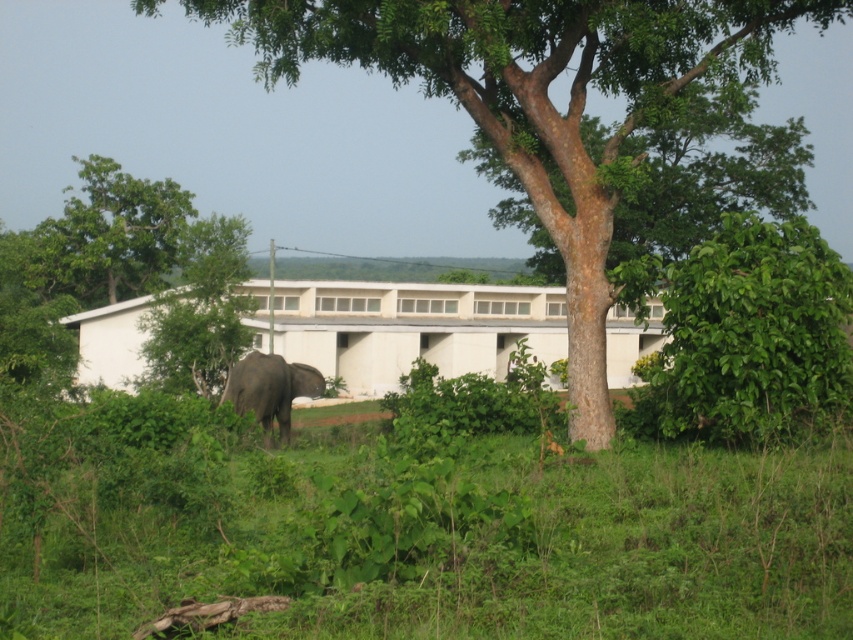
Question: Which point is farther from the camera taking this photo?

Choices:
 (A) 99,189
 (B) 264,413
 (C) 556,572

Answer: (A)

Question: Which of these objects is positioned farthest from the brown rough tree at center?

Choices:
 (A) green leafy tree at upper left
 (B) green leafy grass at lower center
 (C) gray matte elephant at center

Answer: (A)

Question: Is brown rough tree at center to the right of gray matte elephant at center from the viewer's perspective?

Choices:
 (A) no
 (B) yes

Answer: (B)

Question: Can you confirm if green leafy grass at lower center is wider than gray matte elephant at center?

Choices:
 (A) no
 (B) yes

Answer: (B)

Question: Which object appears closest to the camera in this image?

Choices:
 (A) brown rough tree at center
 (B) green leafy grass at lower center
 (C) gray matte elephant at center
 (D) green leafy tree at upper left

Answer: (B)

Question: Can you confirm if green leafy grass at lower center is bigger than gray matte elephant at center?

Choices:
 (A) yes
 (B) no

Answer: (A)